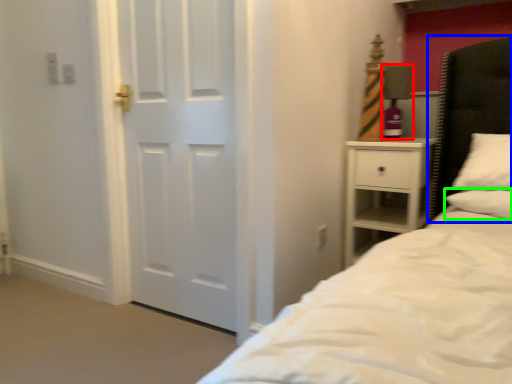
Question: Which object is positioned farthest from lamp (highlighted by a red box)? Select from headboard (highlighted by a blue box) and pillow (highlighted by a green box).

Choices:
 (A) headboard
 (B) pillow

Answer: (B)